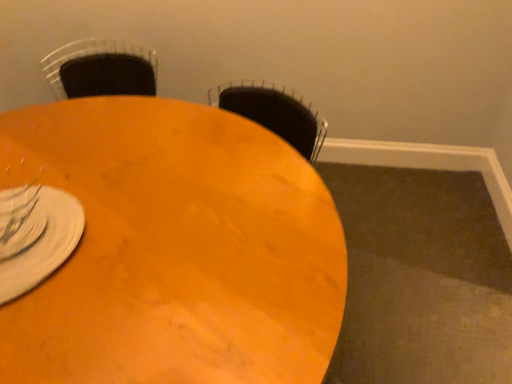
In order to face clear glass fork at lower left, should I rotate leftwards or rightwards?

You should look left and rotate roughly 31.314 degrees.

What do you see at coordinates (35, 236) in the screenshot? I see `clear glass fork at lower left` at bounding box center [35, 236].

Where is `clear glass fork at lower left`? clear glass fork at lower left is located at coordinates (35, 236).

Image resolution: width=512 pixels, height=384 pixels. Describe the element at coordinates (174, 249) in the screenshot. I see `wooden table at center` at that location.

Locate an element on the screen. Image resolution: width=512 pixels, height=384 pixels. wooden table at center is located at coordinates (174, 249).

This screenshot has height=384, width=512. Identify the location of clear glass fork at lower left. (35, 236).

Does clear glass fork at lower left appear on the right side of wooden table at center?

No.

Which object is more forward, clear glass fork at lower left or wooden table at center?

Positioned in front is wooden table at center.

Is point (13, 287) positioned before point (19, 148)?

Yes, it is in front of point (19, 148).

From the image's perspective, relative to wooden table at center, is clear glass fork at lower left above or below?

clear glass fork at lower left is above wooden table at center.

From a real-world perspective, is clear glass fork at lower left on wooden table at center?

Indeed, from a real-world perspective, clear glass fork at lower left stands above wooden table at center.

Which of these two, clear glass fork at lower left or wooden table at center, is thinner?

With smaller width is clear glass fork at lower left.

Considering the sizes of clear glass fork at lower left and wooden table at center in the image, is clear glass fork at lower left taller or shorter than wooden table at center?

Clearly, clear glass fork at lower left is shorter compared to wooden table at center.

Considering the relative sizes of clear glass fork at lower left and wooden table at center in the image provided, is clear glass fork at lower left smaller than wooden table at center?

Correct, clear glass fork at lower left occupies less space than wooden table at center.

Do you think clear glass fork at lower left is within wooden table at center, or outside of it?

clear glass fork at lower left cannot be found inside wooden table at center.

Are clear glass fork at lower left and wooden table at center making contact?

No, clear glass fork at lower left is not next to wooden table at center.

Is clear glass fork at lower left looking in the opposite direction of wooden table at center?

No.

In the scene shown: How many degrees apart are the facing directions of clear glass fork at lower left and wooden table at center?

clear glass fork at lower left and wooden table at center are facing 90.5 degrees away from each other.

How far apart are clear glass fork at lower left and wooden table at center?

25.47 centimeters.

Where is `table below the clear glass fork at lower left (from the image's perspective)`? table below the clear glass fork at lower left (from the image's perspective) is located at coordinates (174, 249).

Which is more to the left, wooden table at center or clear glass fork at lower left?

From the viewer's perspective, clear glass fork at lower left appears more on the left side.

Which object is closer to the camera taking this photo, wooden table at center or clear glass fork at lower left?

wooden table at center is in front.

Considering the positions of points (237, 293) and (19, 291), is point (237, 293) farther from camera compared to point (19, 291)?

That is False.

From the image's perspective, between wooden table at center and clear glass fork at lower left, who is located below?

wooden table at center appears lower in the image.

From a real-world perspective, who is located higher, wooden table at center or clear glass fork at lower left?

clear glass fork at lower left.

Can you confirm if wooden table at center is wider than clear glass fork at lower left?

Correct, the width of wooden table at center exceeds that of clear glass fork at lower left.

From the picture: Is wooden table at center taller or shorter than clear glass fork at lower left?

Clearly, wooden table at center is taller compared to clear glass fork at lower left.

Between wooden table at center and clear glass fork at lower left, which one has smaller size?

Smaller between the two is clear glass fork at lower left.

Do you think wooden table at center is within clear glass fork at lower left, or outside of it?

wooden table at center is not inside clear glass fork at lower left, it's outside.

Is wooden table at center far from clear glass fork at lower left?

They are positioned close to each other.

Does wooden table at center turn towards clear glass fork at lower left?

No, wooden table at center is not oriented towards clear glass fork at lower left.

In the scene shown: How different are the orientations of wooden table at center and clear glass fork at lower left in degrees?

90.5 degrees.

Identify the location of table on the right of clear glass fork at lower left. The height and width of the screenshot is (384, 512). (174, 249).

This screenshot has width=512, height=384. I want to click on table that appears on the right of clear glass fork at lower left, so click(174, 249).

Identify the location of tableware on the left of wooden table at center. Image resolution: width=512 pixels, height=384 pixels. (35, 236).